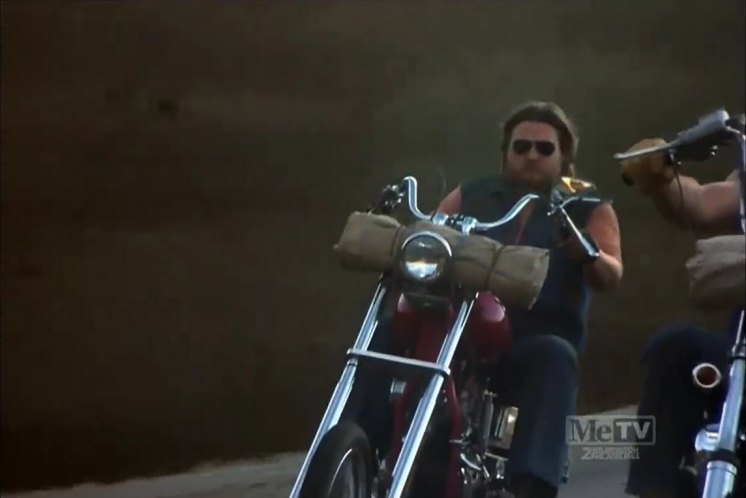
Identify the location of light. (424, 255).